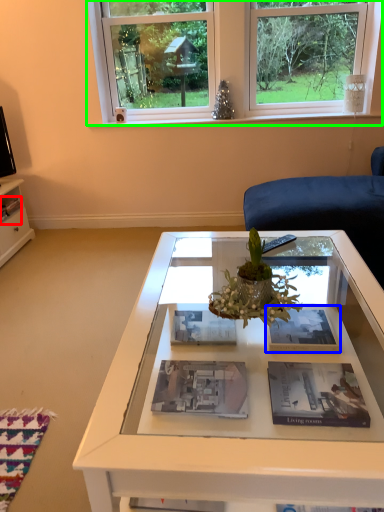
Question: Which object is the farthest from magazine (highlighted by a red box)? Choose among these: magazine (highlighted by a blue box) or window (highlighted by a green box).

Choices:
 (A) magazine
 (B) window

Answer: (A)